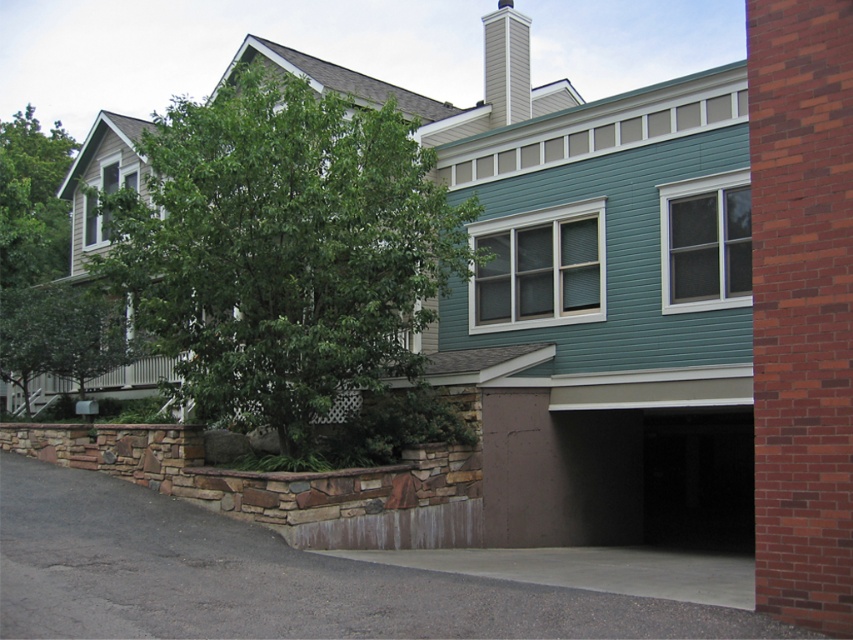
You are standing in front of the residential building and want to locate two specific points marked on the ground. The first point is at coordinates point (196, 234) and the second is at point (44, 272). Which point is closer to you as you face the building?

Point (196, 234) is in front of point (44, 272), so the first point is closer to you as you face the building.

You are standing in front of the residential building and want to take a photo. You notice two points marked in the image. Which point is closer to your camera, point [300,209] or point [520,112]?

Point [300,209] is closer to the camera than point [520,112].

You are standing at the entrance of the residential building and want to park your car on the gray concrete driveway at lower left. From your current position, which direction should you move to reach the driveway?

The gray concrete driveway at lower left is located at point (267, 579), so you should move towards the lower left direction to reach it.